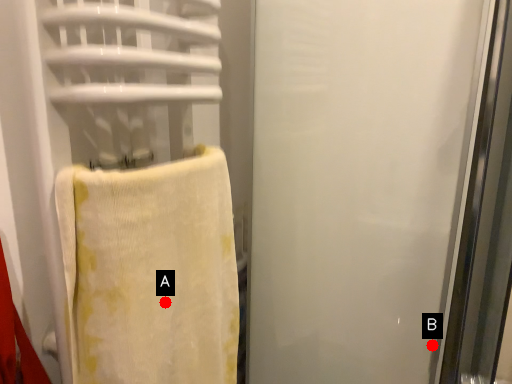
Question: Two points are circled on the image, labeled by A and B beside each circle. Which point appears closest to the camera in this image?

Choices:
 (A) A is closer
 (B) B is closer

Answer: (A)